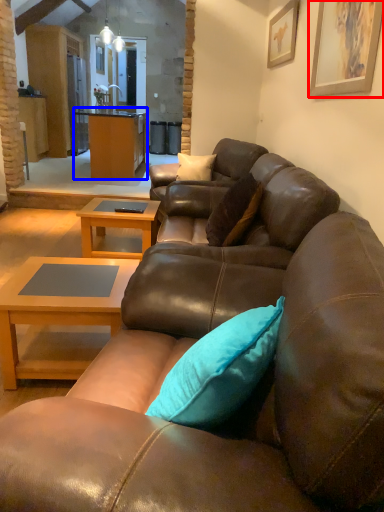
Question: Among these objects, which one is nearest to the camera, picture frame (highlighted by a red box) or cabinetry (highlighted by a blue box)?

Choices:
 (A) picture frame
 (B) cabinetry

Answer: (A)